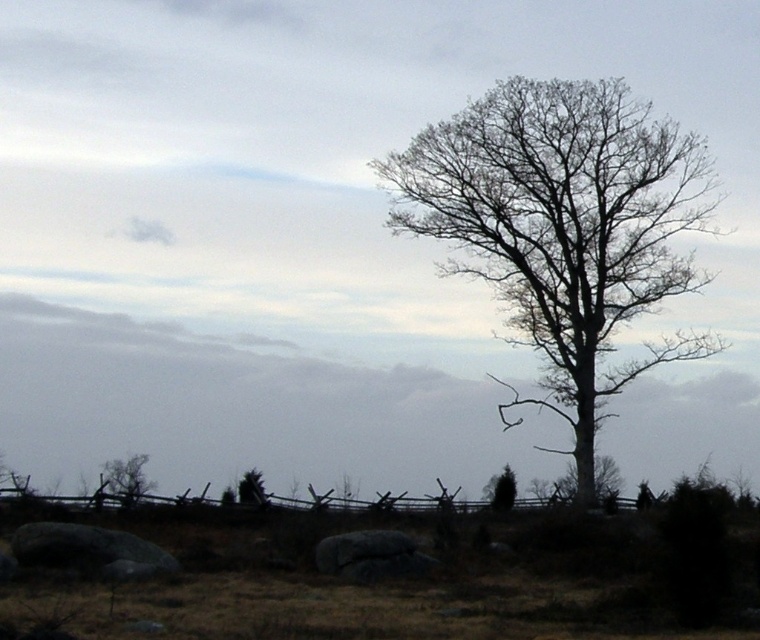
You are standing in the landscape scene and want to walk from the point closer to you to the point further away. Which path would you take between the two points, point (353, 563) and point (505, 470)?

The point closer to the viewer is point (353, 563), so you should walk from point (353, 563) to point (505, 470) to reach the one further away.

You are a landscape painter setting up your easel. You want to paint the scene focusing on the gray rough stone at lower center and the green matte tree at lower left. Which object should you place closer to the center of your canvas to emphasize its size?

Since the gray rough stone at lower center occupies less space than the green matte tree at lower left, you should place the green matte tree at lower left closer to the center of your canvas to emphasize its larger size.

You are an artist sketching this landscape. You need to place the bare wood tree at center and the brown textured tree at lower left in your drawing. According to the scene, which tree should be drawn to the right side of the other?

The bare wood tree at center is positioned on the right side of brown textured tree at lower left, so the brown textured tree at lower left should be drawn to the left of the bare wood tree at center.